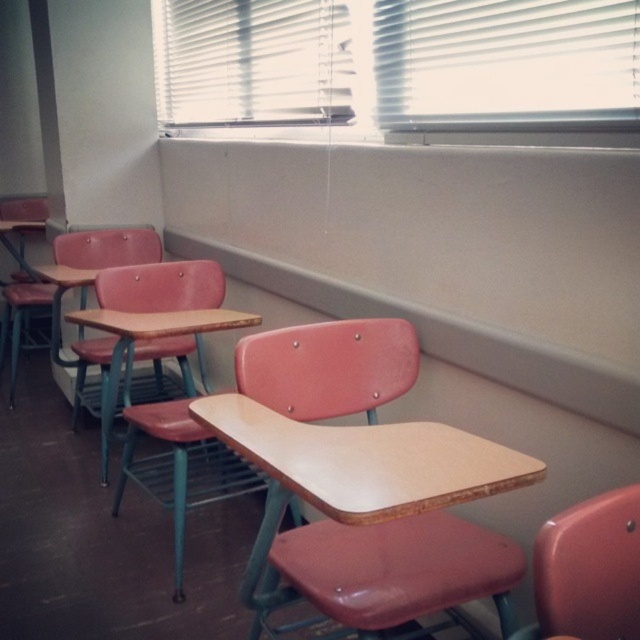
Who is positioned more to the left, matte pink chair at lower right or matte plastic chair at center?

Positioned to the left is matte plastic chair at center.

Is point (621, 632) positioned in front of point (140, 285)?

That is True.

Which is behind, point (632, 541) or point (195, 269)?

Point (195, 269)

You are a GUI agent. You are given a task and a screenshot of the screen. Output one action in this format:
    pyautogui.click(x=<x>, y=<y>)
    Task: Click on the matte pink chair at lower right
    
    Given the screenshot: What is the action you would take?
    pyautogui.click(x=588, y=570)

From the picture: Who is shorter, white blinds at upper center or matte wood desk at center?

Standing shorter between the two is matte wood desk at center.

Does white blinds at upper center come in front of matte wood desk at center?

That is False.

Find the location of `white blinds at upper center`. white blinds at upper center is located at coordinates (400, 70).

Can you confirm if white blinds at upper center is thinner than matte pink chair at lower right?

No, white blinds at upper center is not thinner than matte pink chair at lower right.

Who is more distant from viewer, (214, 36) or (556, 531)?

Point (214, 36)

Is point (160, 96) farther from viewer compared to point (554, 637)?

Yes.

The image size is (640, 640). Identify the location of white blinds at upper center. (400, 70).